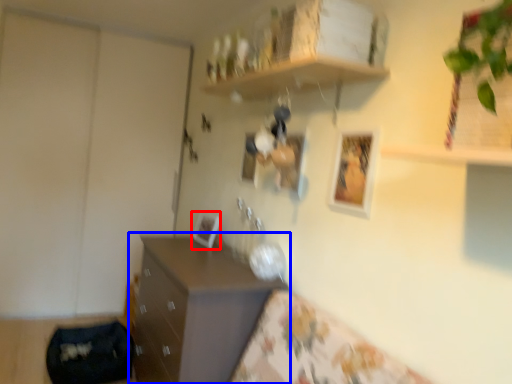
Question: Which of the following is the farthest to the observer, picture frame (highlighted by a red box) or chest of drawers (highlighted by a blue box)?

Choices:
 (A) picture frame
 (B) chest of drawers

Answer: (A)